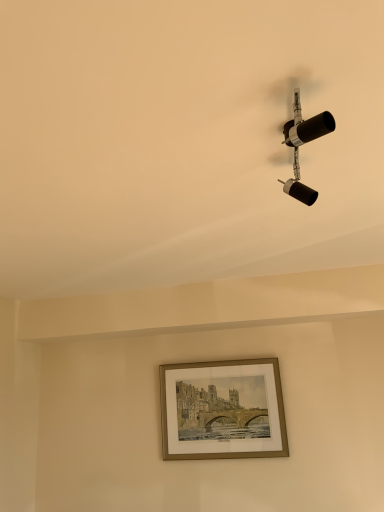
Question: Is matte black spotlight at upper right bigger or smaller than gold metallic picture frame at center?

Choices:
 (A) small
 (B) big

Answer: (A)

Question: In terms of height, does matte black spotlight at upper right look taller or shorter compared to gold metallic picture frame at center?

Choices:
 (A) tall
 (B) short

Answer: (B)

Question: From a real-world perspective, relative to gold metallic picture frame at center, is matte black spotlight at upper right vertically above or below?

Choices:
 (A) above
 (B) below

Answer: (A)

Question: In the image, is gold metallic picture frame at center positioned in front of or behind matte black spotlight at upper right?

Choices:
 (A) behind
 (B) front

Answer: (A)

Question: Is gold metallic picture frame at center to the left or to the right of matte black spotlight at upper right in the image?

Choices:
 (A) left
 (B) right

Answer: (A)

Question: In terms of width, does gold metallic picture frame at center look wider or thinner when compared to matte black spotlight at upper right?

Choices:
 (A) thin
 (B) wide

Answer: (A)

Question: Is point (264, 370) closer or farther from the camera than point (291, 126)?

Choices:
 (A) farther
 (B) closer

Answer: (A)